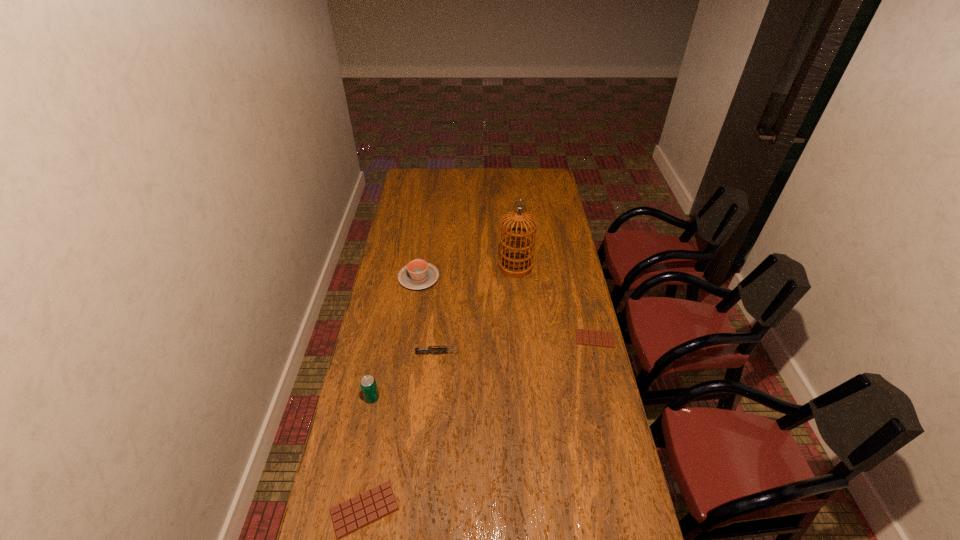
Identify which object is the second nearest to the second object from right to left. Please provide its 2D coordinates. Your answer should be formatted as a tuple, i.e. [(x, y)], where the tuple contains the x and y coordinates of a point satisfying the conditions above.

[(583, 337)]

You are a GUI agent. You are given a task and a screenshot of the screen. Output one action in this format:
    pyautogui.click(x=<x>, y=<y>)
    Task: Click on the object identified as the closest to the third farthest object
    Image resolution: width=960 pixels, height=540 pixels.
    Given the screenshot: What is the action you would take?
    pyautogui.click(x=516, y=264)

At what (x,y) coordinates should I click in order to perform the action: click on free space that satisfies the following two spatial constraints: 1. aimed along the barrel of the third nearest object; 2. on the front side of the beer can. Please return your answer as a coordinate pair (x, y). This screenshot has height=540, width=960. Looking at the image, I should click on (434, 397).

Where is `vacant space that satisfies the following two spatial constraints: 1. on the front side of the tallest object; 2. on the left side of the rightmost object`? vacant space that satisfies the following two spatial constraints: 1. on the front side of the tallest object; 2. on the left side of the rightmost object is located at coordinates (522, 339).